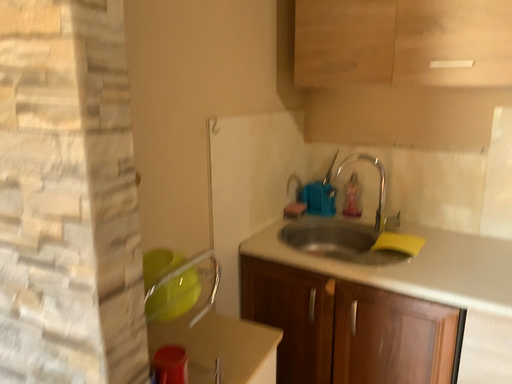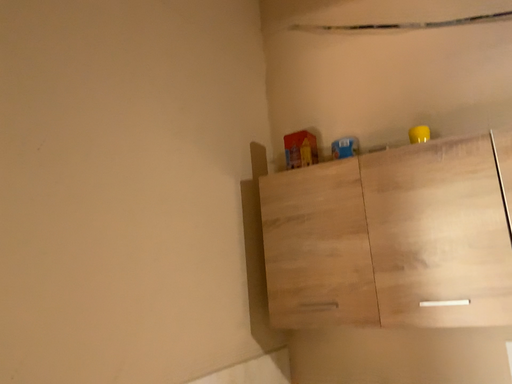
Question: Which way did the camera rotate in the video?

Choices:
 (A) rotated downward
 (B) rotated upward

Answer: (B)